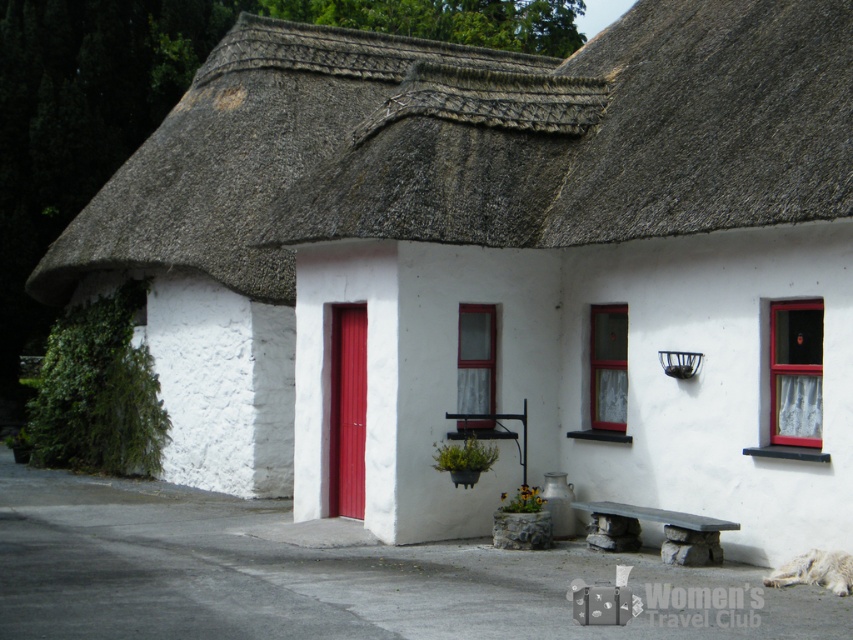
You are a painter planning to paint the matte glass window at center and the smooth stone bench at center. Since you want to use the least amount of paint possible, which object should you choose to paint first?

The matte glass window at center occupies less space than the smooth stone bench at center, so painting the matte glass window at center first would require less paint.

You are standing in front of the traditional house and want to know which object is taller between the matte glass window at upper right and the smooth stone bench at center. Can you tell me?

The matte glass window at upper right has a greater height compared to the smooth stone bench at center, so the matte glass window at upper right is taller.